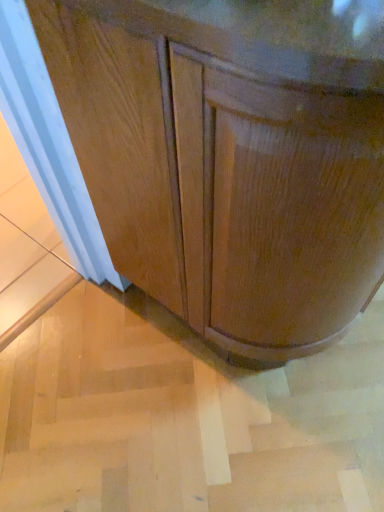
Question: Considering the positions of glossy wood cabinet at center and light brown wood stair at lower left in the image, is glossy wood cabinet at center wider or thinner than light brown wood stair at lower left?

Choices:
 (A) thin
 (B) wide

Answer: (A)

Question: Is glossy wood cabinet at center taller or shorter than light brown wood stair at lower left?

Choices:
 (A) tall
 (B) short

Answer: (A)

Question: In the image, is glossy wood cabinet at center positioned in front of or behind light brown wood stair at lower left?

Choices:
 (A) behind
 (B) front

Answer: (B)

Question: In terms of height, does light brown wood stair at lower left look taller or shorter compared to glossy wood cabinet at center?

Choices:
 (A) short
 (B) tall

Answer: (A)

Question: Is light brown wood stair at lower left to the left or to the right of glossy wood cabinet at center in the image?

Choices:
 (A) left
 (B) right

Answer: (A)

Question: In terms of width, does light brown wood stair at lower left look wider or thinner when compared to glossy wood cabinet at center?

Choices:
 (A) thin
 (B) wide

Answer: (B)

Question: In the image, is light brown wood stair at lower left positioned in front of or behind glossy wood cabinet at center?

Choices:
 (A) behind
 (B) front

Answer: (A)